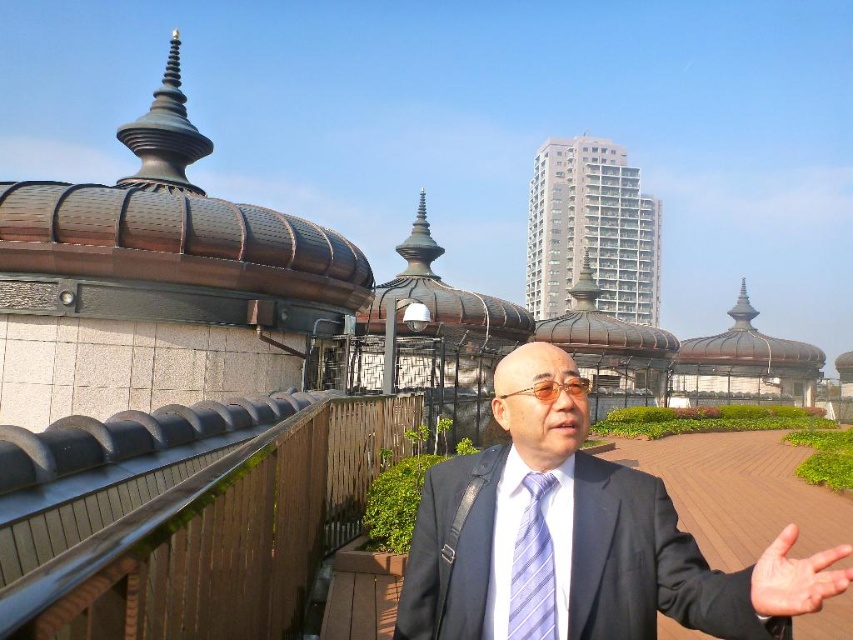
You are a photographer trying to capture a portrait of the man in the scene. You want to ensure that both the matte black suit at center and the light blue striped tie at center are clearly visible in the frame. Based on their positions, which side of the man should you position the light source to highlight both the suit and the tie effectively?

The matte black suit at center is to the right of the light blue striped tie at center. To highlight both effectively, position the light source to the left of the man so that it illuminates both the tie and the suit without casting shadows over either.

You are standing on the rooftop and want to reach the point marked at coordinates (541,380). If your current position is 20 meters away from that point, how much further do you need to walk to reach it?

The point marked at coordinates (541,380) is 22.26 meters away from the camera. Since you are currently 20 meters away from it, you need to walk an additional 2.26 meters to reach the point.

You are a tailor measuring a client for a new suit. You notice the matte black suit at center and the light skin hand at center. Which object is wider?

The matte black suit at center is wider than the light skin hand at center.